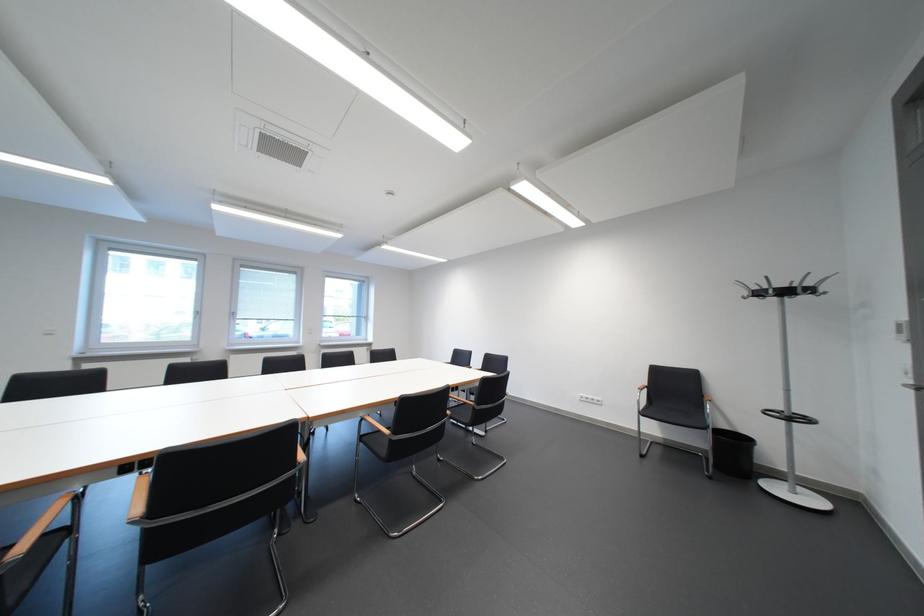
At what (x,y) coordinates should I click in order to perform the action: click on metal door handle. Please return your answer as a coordinate pair (x, y). The width and height of the screenshot is (924, 616). Looking at the image, I should click on (912, 386).